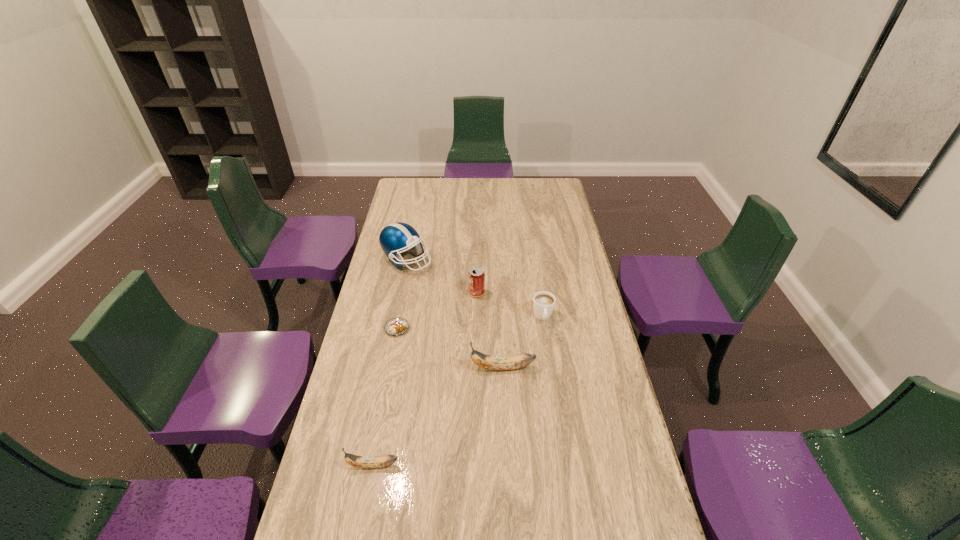
You are a GUI agent. You are given a task and a screenshot of the screen. Output one action in this format:
    pyautogui.click(x=<x>, y=<y>)
    Task: Click on the free point between the second farthest object and the shorter banana
    This screenshot has height=540, width=960.
    Given the screenshot: What is the action you would take?
    pyautogui.click(x=424, y=379)

At what (x,y) coordinates should I click in order to perform the action: click on free space between the nearest object and the soda can. Please return your answer as a coordinate pair (x, y). Looking at the image, I should click on (424, 379).

Where is `vacant area that lies between the shortest object and the farther banana`? The height and width of the screenshot is (540, 960). vacant area that lies between the shortest object and the farther banana is located at coordinates (449, 348).

Where is `the fourth closest object relative to the cappuccino`? the fourth closest object relative to the cappuccino is located at coordinates (396, 326).

Identify which object is the fourth nearest to the nearer banana. Please provide its 2D coordinates. Your answer should be formatted as a tuple, i.e. [(x, y)], where the tuple contains the x and y coordinates of a point satisfying the conditions above.

[(476, 277)]

Locate an element on the screen. The width and height of the screenshot is (960, 540). vacant space that satisfies the following two spatial constraints: 1. on the front side of the soda can; 2. on the peel of the shorter banana is located at coordinates (475, 465).

Identify the location of vacant space that satisfies the following two spatial constraints: 1. at the front of the tallest object with the faceguard; 2. on the back side of the second farthest object. (400, 293).